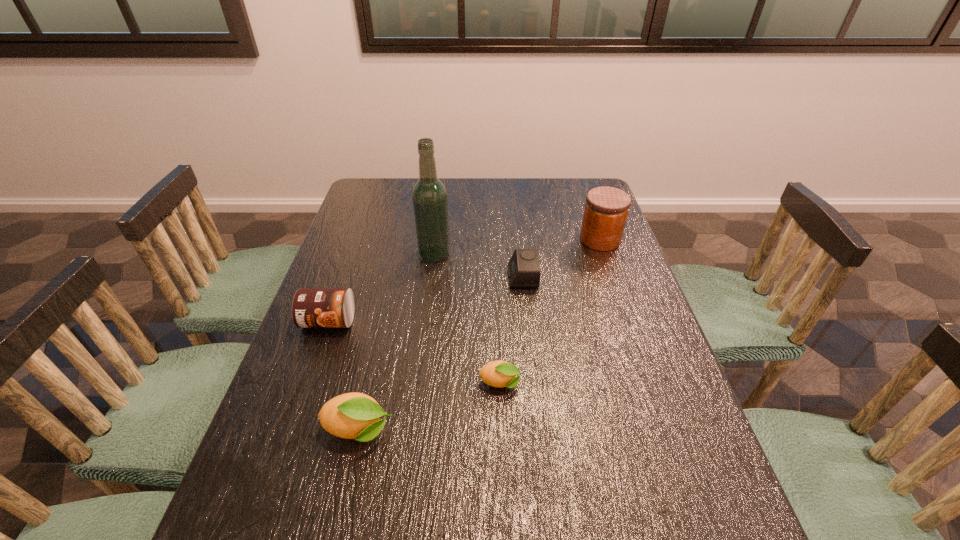
Where is `vacant point located between the alarm clock and the fourth farthest object`? This screenshot has width=960, height=540. vacant point located between the alarm clock and the fourth farthest object is located at coordinates (425, 299).

Image resolution: width=960 pixels, height=540 pixels. I want to click on free spot between the liquor and the leftmost object, so point(381,287).

I want to click on vacant area that lies between the tallest object and the nearer lemon, so click(x=396, y=342).

You are a GUI agent. You are given a task and a screenshot of the screen. Output one action in this format:
    pyautogui.click(x=<x>, y=<y>)
    Task: Click on the free space between the tallest object and the third farthest object
    
    Given the screenshot: What is the action you would take?
    pyautogui.click(x=479, y=265)

Image resolution: width=960 pixels, height=540 pixels. In order to click on vacant space that's between the left lemon and the fifth farthest object in this screenshot , I will do `click(429, 407)`.

The height and width of the screenshot is (540, 960). Identify the location of free space between the second nearest object and the left lemon. (429, 407).

Locate an element on the screen. This screenshot has height=540, width=960. object identified as the fifth closest to the third farthest object is located at coordinates (357, 416).

Identify the location of object that is the fifth closest to the fifth farthest object. The height and width of the screenshot is (540, 960). (606, 209).

Identify the location of free spot that satisfies the following two spatial constraints: 1. on the front-facing side of the fourth nearest object; 2. on the front label of the leftmost object. 527,321.

Identify the location of vacant position in the image that satisfies the following two spatial constraints: 1. on the front-facing side of the alarm clock; 2. on the front label of the leftmost object. Image resolution: width=960 pixels, height=540 pixels. (527, 321).